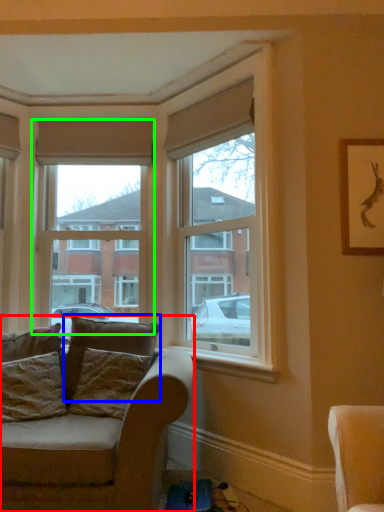
Question: Estimate the real-world distances between objects in this image. Which object is closer to studio couch (highlighted by a red box), pillow (highlighted by a blue box) or window (highlighted by a green box)?

Choices:
 (A) pillow
 (B) window

Answer: (A)